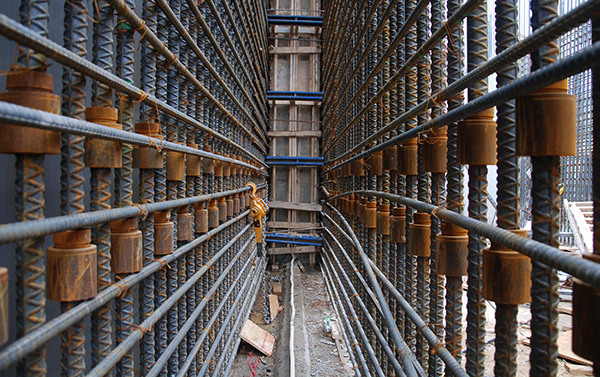
You are a GUI agent. You are given a task and a screenshot of the screen. Output one action in this format:
    pyautogui.click(x=<x>, y=<y>)
    Task: Click on the hook
    The image size is (600, 377).
    Given the screenshot: What is the action you would take?
    pyautogui.click(x=262, y=317)